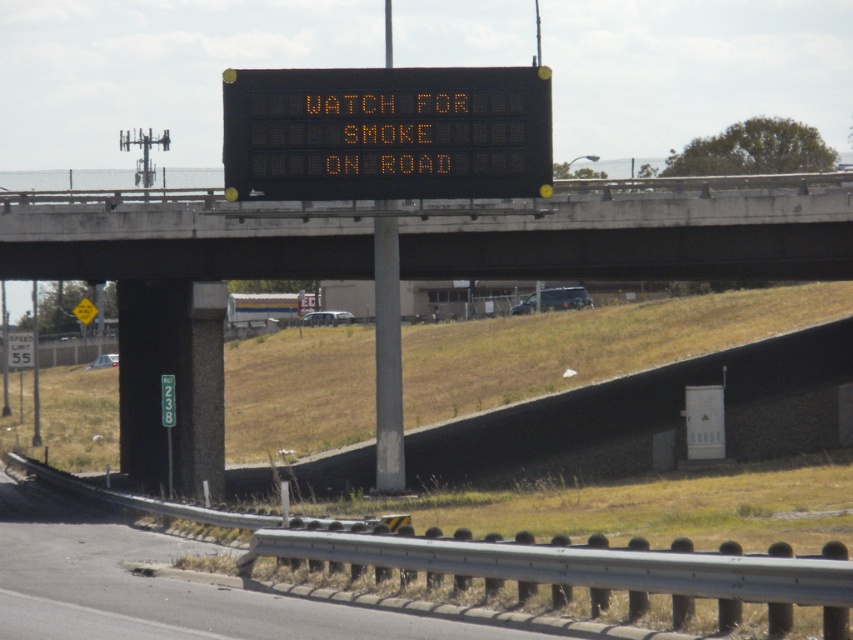
You are a truck driver approaching the highway curve and see the concrete at upper center and the black electronic display at upper center ahead. Which object is located to the right of the other?

The concrete at upper center is positioned on the right side of black electronic display at upper center, so the concrete at upper center is to the right of the black electronic display at upper center.

You are standing at the point marked by the coordinates point (398, 264). Based on the scene description, what type of surface are you currently standing on?

The point (398, 264) marks concrete at upper center, so you are standing on concrete.

You are a truck driver approaching the black concrete overpass at upper center and the black electronic display at upper center. Your truck is 15 feet tall. Can you safely pass under both without hitting them?

The black concrete overpass at upper center and black electronic display at upper center are 21.79 feet apart. Since your truck is 15 feet tall, you have sufficient clearance to pass under both safely.